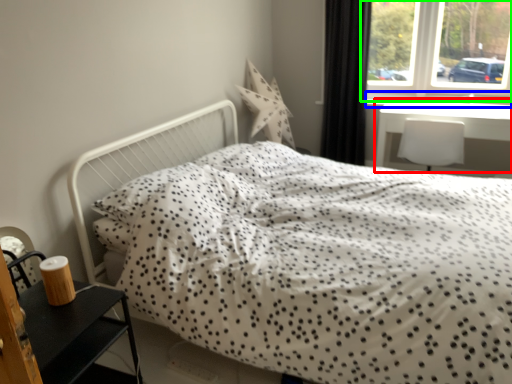
Question: Which is farther away from table (highlighted by a red box)? window sill (highlighted by a blue box) or window (highlighted by a green box)?

Choices:
 (A) window sill
 (B) window

Answer: (B)